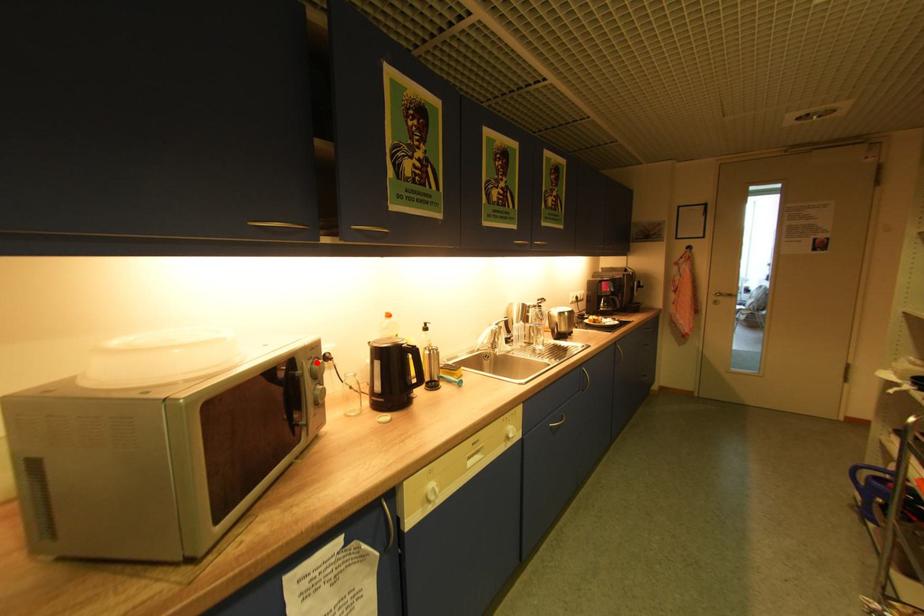
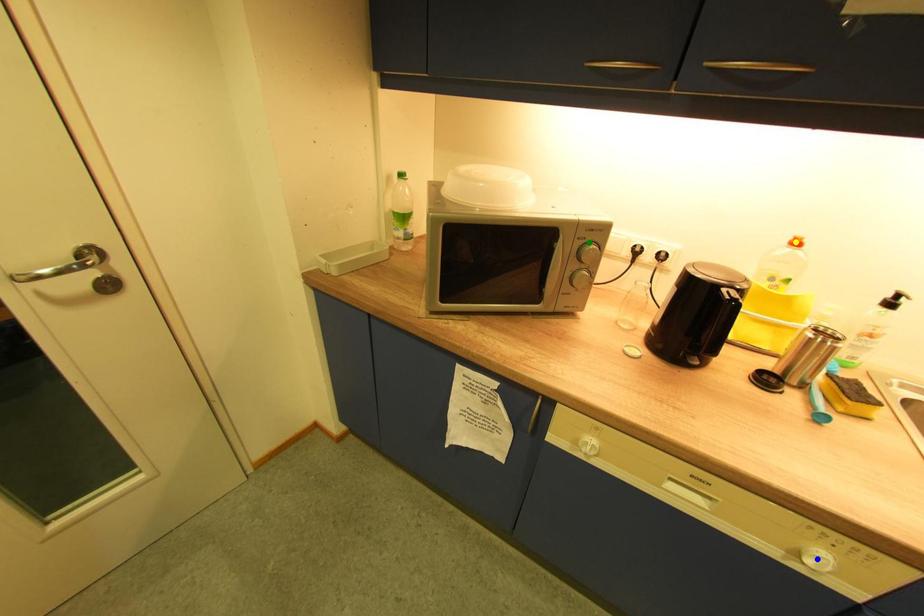
Question: I am providing you with two images of the same scene from different viewpoints. A red point is marked on the first image. You are given multiple points on the second image. Which point in image 2 is actually the same real-world point as the red point in image 1?

Choices:
 (A) blue point
 (B) yellow point
 (C) green point

Answer: (C)